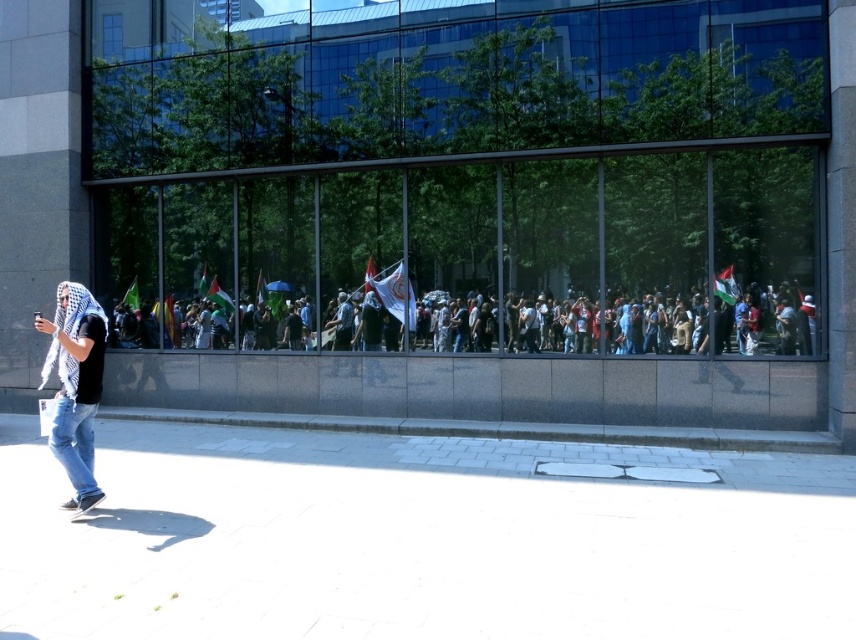
Question: Which point is closer to the camera taking this photo?

Choices:
 (A) (550, 637)
 (B) (82, 508)
 (C) (578, 337)

Answer: (A)

Question: Is multicolored flags at center smaller than white checkered scarf at left?

Choices:
 (A) no
 (B) yes

Answer: (B)

Question: Among these objects, which one is nearest to the camera?

Choices:
 (A) white checkered scarf at left
 (B) multicolored flags at center

Answer: (A)

Question: Does white concrete pavement at lower left appear under white checkered scarf at left?

Choices:
 (A) yes
 (B) no

Answer: (A)

Question: Does white concrete pavement at lower left have a lesser width compared to multicolored flags at center?

Choices:
 (A) no
 (B) yes

Answer: (A)

Question: Which of the following is the farthest from the observer?

Choices:
 (A) (147, 317)
 (B) (70, 369)
 (C) (508, 568)

Answer: (A)